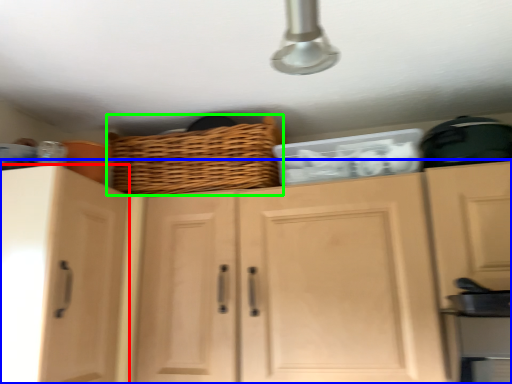
Question: Considering the real-world distances, which object is farthest from cabinetry (highlighted by a red box)? cabinetry (highlighted by a blue box) or basket (highlighted by a green box)?

Choices:
 (A) cabinetry
 (B) basket

Answer: (B)